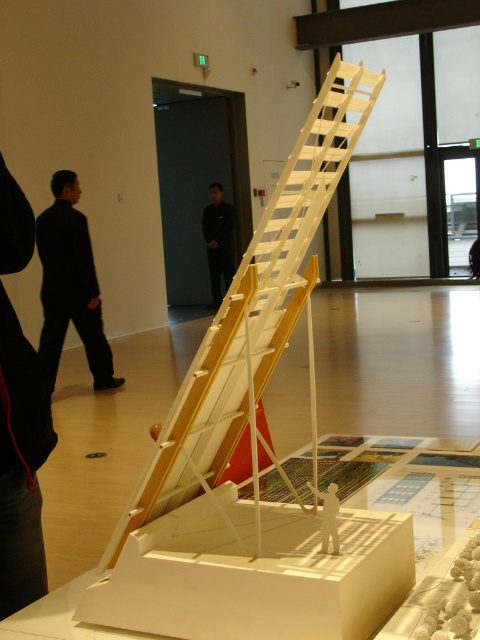
Does black fabric at left have a smaller size compared to black suit at left?

Indeed, black fabric at left has a smaller size compared to black suit at left.

In the scene shown: Is black fabric at left to the right of black suit at left from the viewer's perspective?

Correct, you'll find black fabric at left to the right of black suit at left.

This screenshot has width=480, height=640. Identify the location of black fabric at left. (21, 464).

Which is more to the right, white matte ladder at center or black fabric at left?

Positioned to the right is white matte ladder at center.

Find the location of `white matte ladder at center`. white matte ladder at center is located at coordinates (252, 310).

Identify the location of white matte ladder at center. (252, 310).

Find the location of a particular element. white matte ladder at center is located at coordinates (252, 310).

Is point (191, 412) less distant than point (213, 275)?

Yes.

Does white matte ladder at center have a greater height compared to black smooth suit at center?

In fact, white matte ladder at center may be shorter than black smooth suit at center.

Locate an element on the screen. This screenshot has height=640, width=480. white matte ladder at center is located at coordinates (252, 310).